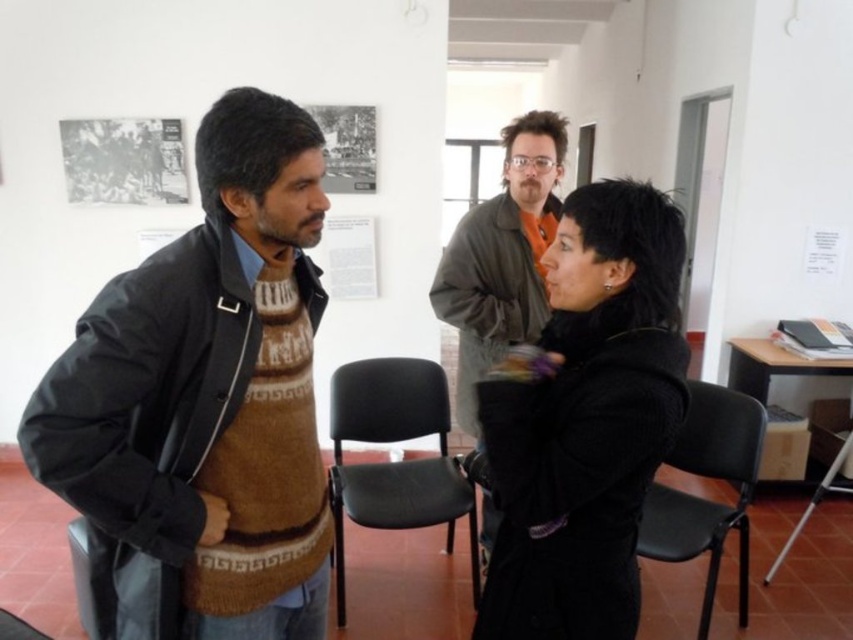
Between gray leather jacket at center and black plastic chair at center, which one has more height?

With more height is gray leather jacket at center.

Can you confirm if gray leather jacket at center is bigger than black plastic chair at center?

Yes, gray leather jacket at center is bigger than black plastic chair at center.

Measure the distance between point (463, 324) and camera.

Point (463, 324) and camera are 7.44 feet apart.

Identify the location of gray leather jacket at center. The height and width of the screenshot is (640, 853). (502, 257).

Does brown knitted sweater at center have a larger size compared to gray leather jacket at center?

No.

Between brown knitted sweater at center and gray leather jacket at center, which one is positioned higher?

gray leather jacket at center is above.

Measure the distance between brown knitted sweater at center and camera.

brown knitted sweater at center is 3.47 feet from camera.

Where is `brown knitted sweater at center`? brown knitted sweater at center is located at coordinates (204, 403).

Who is more forward, [552,256] or [732,426]?

Point [552,256]

Does black wool coat at center appear under black plastic chair at lower right?

Incorrect, black wool coat at center is not positioned below black plastic chair at lower right.

Locate an element on the screen. The image size is (853, 640). black wool coat at center is located at coordinates (585, 420).